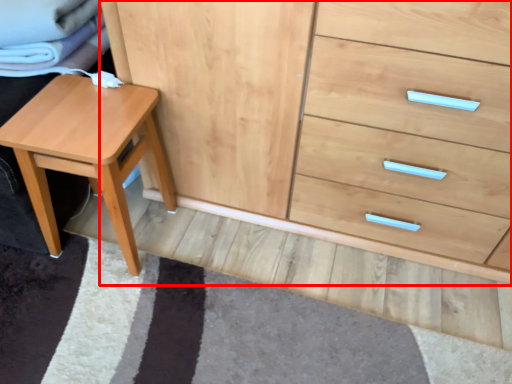
Question: From the image's perspective, what is the correct spatial relationship of chest of drawers (annotated by the red box) in relation to stool?

Choices:
 (A) below
 (B) above

Answer: (B)